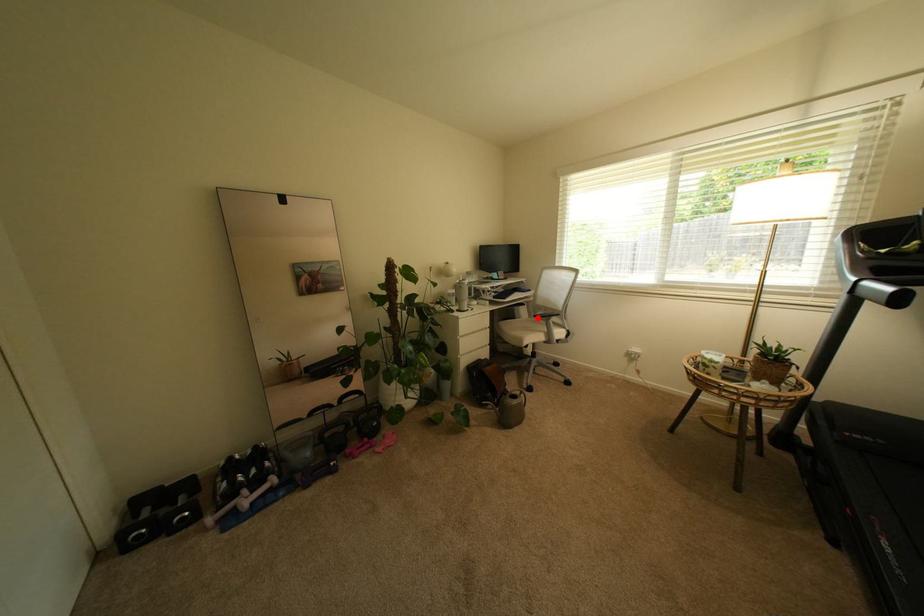
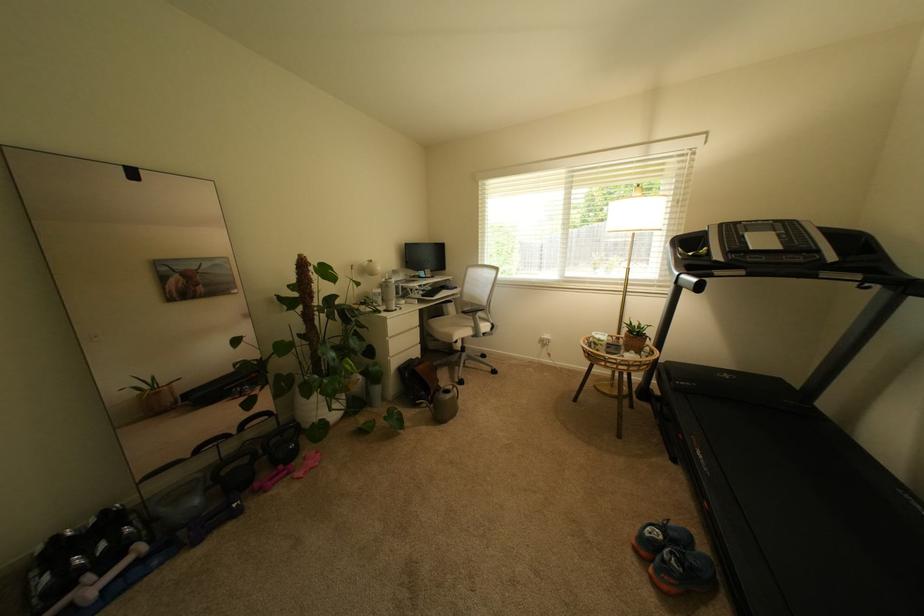
Question: I am providing you with two images of the same scene from different viewpoints. Given a red point in image1, look at the same physical point in image2. Is it:

Choices:
 (A) Closer to the viewpoint
 (B) Farther from the viewpoint

Answer: (B)